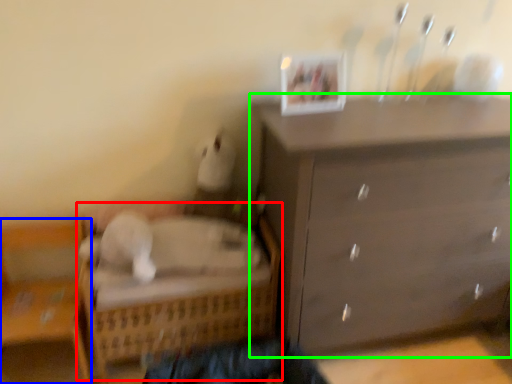
Question: Which object is the farthest from bed (highlighted by a red box)? Choose among these: furniture (highlighted by a blue box) or chest of drawers (highlighted by a green box).

Choices:
 (A) furniture
 (B) chest of drawers

Answer: (B)